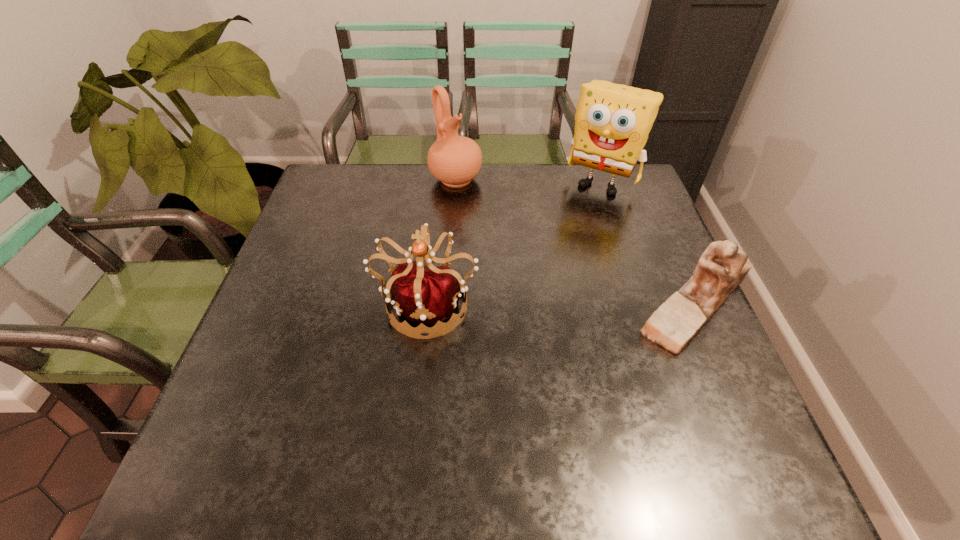
The width and height of the screenshot is (960, 540). In order to click on vacant area that lies between the sponge and the figurine in this screenshot , I will do `click(649, 243)`.

The height and width of the screenshot is (540, 960). I want to click on the second closest object to the figurine, so click(x=427, y=294).

Locate which object is the second closest to the sponge. Please provide its 2D coordinates. Your answer should be formatted as a tuple, i.e. [(x, y)], where the tuple contains the x and y coordinates of a point satisfying the conditions above.

[(723, 266)]

Where is `vacant point that satisfies the following two spatial constraints: 1. on the front-facing side of the figurine; 2. on the front-facing side of the tiara`? The image size is (960, 540). vacant point that satisfies the following two spatial constraints: 1. on the front-facing side of the figurine; 2. on the front-facing side of the tiara is located at coordinates (427, 304).

The width and height of the screenshot is (960, 540). What are the coordinates of `free space that satisfies the following two spatial constraints: 1. on the front-facing side of the third tallest object; 2. on the front-facing side of the shortest object` in the screenshot? It's located at (427, 304).

Identify the location of free region that satisfies the following two spatial constraints: 1. on the front-facing side of the tiara; 2. on the front-facing side of the figurine. (427, 304).

You are a GUI agent. You are given a task and a screenshot of the screen. Output one action in this format:
    pyautogui.click(x=<x>, y=<y>)
    Task: Click on the vacant position in the image that satisfies the following two spatial constraints: 1. on the front side of the sponge; 2. on the front-facing side of the figurine
    Image resolution: width=960 pixels, height=540 pixels.
    Given the screenshot: What is the action you would take?
    pyautogui.click(x=642, y=304)

The image size is (960, 540). What are the coordinates of `free point that satisfies the following two spatial constraints: 1. on the front-facing side of the second shortest object; 2. on the front-facing side of the shortest object` in the screenshot? It's located at (427, 304).

The height and width of the screenshot is (540, 960). Find the location of `free space that satisfies the following two spatial constraints: 1. on the front-facing side of the third tallest object; 2. on the front-facing side of the shortest object`. free space that satisfies the following two spatial constraints: 1. on the front-facing side of the third tallest object; 2. on the front-facing side of the shortest object is located at coordinates (427, 304).